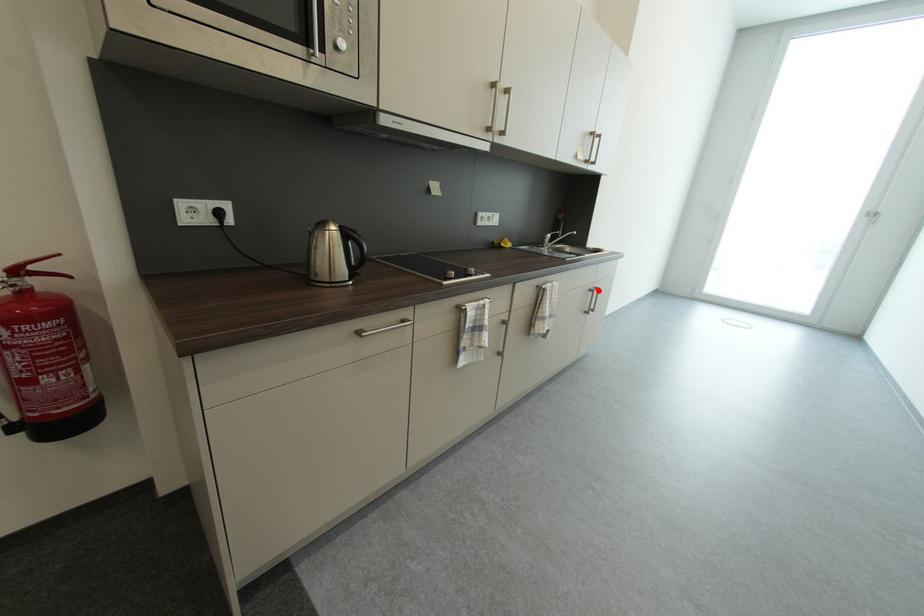
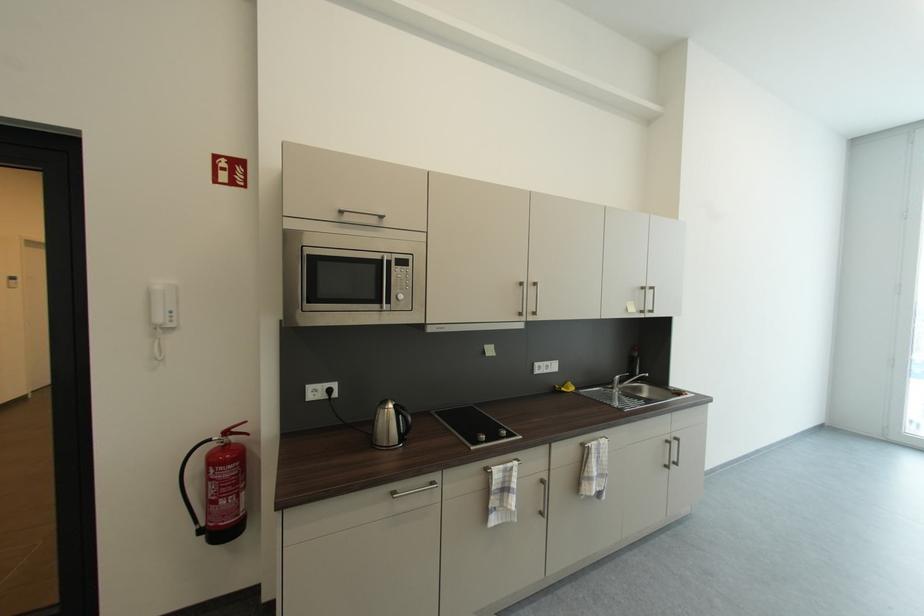
The point at the highlighted location is marked in the first image. Where is the corresponding point in the second image?

(675, 440)